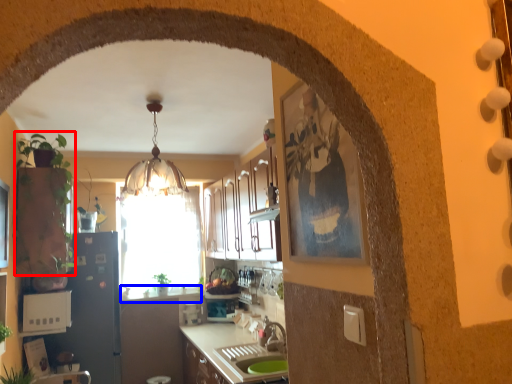
Question: Which object is further to the camera taking this photo, plant (highlighted by a red box) or counter top (highlighted by a blue box)?

Choices:
 (A) plant
 (B) counter top

Answer: (B)